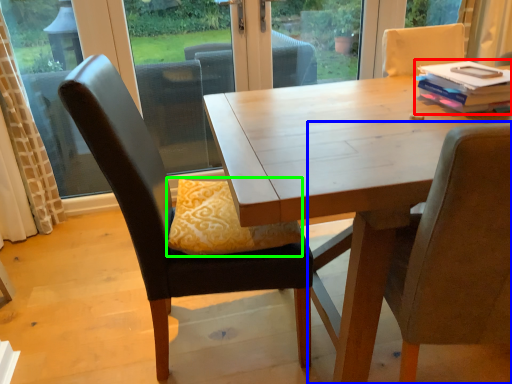
Question: Based on their relative distances, which object is nearer to book (highlighted by a red box)? Choose from chair (highlighted by a blue box) and pillow (highlighted by a green box).

Choices:
 (A) chair
 (B) pillow

Answer: (A)